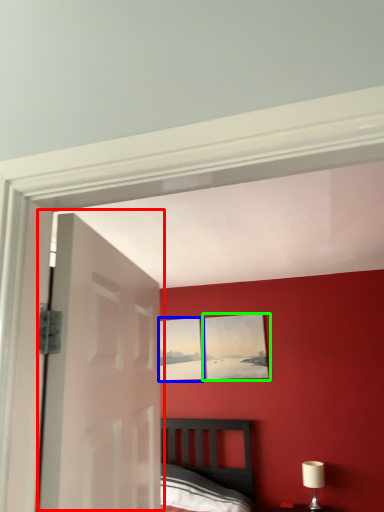
Question: Estimate the real-world distances between objects in this image. Which object is closer to door (highlighted by a red box), picture frame (highlighted by a blue box) or picture frame (highlighted by a green box)?

Choices:
 (A) picture frame
 (B) picture frame

Answer: (B)